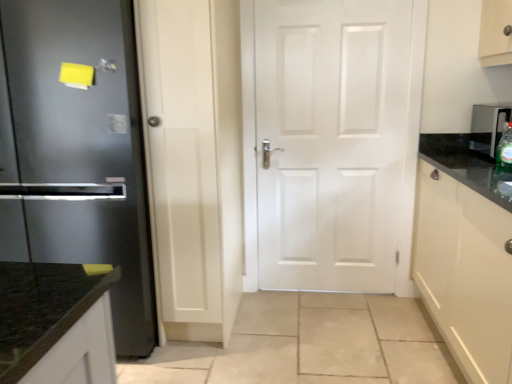
Question: Considering the positions of glossy white cabinet at right and white matte door at center in the image, is glossy white cabinet at right bigger or smaller than white matte door at center?

Choices:
 (A) big
 (B) small

Answer: (A)

Question: Do you think glossy white cabinet at right is within white matte door at center, or outside of it?

Choices:
 (A) outside
 (B) inside

Answer: (A)

Question: Which object is positioned farthest from the white matte door at center?

Choices:
 (A) green glass bottle at right
 (B) glossy white cabinet at right
 (C) satin steel refrigerator at left
 (D) metallic silver water dispenser at right

Answer: (C)

Question: Which object is the closest to the satin steel refrigerator at left?

Choices:
 (A) glossy white cabinet at right
 (B) green glass bottle at right
 (C) white matte door at center
 (D) metallic silver water dispenser at right

Answer: (C)